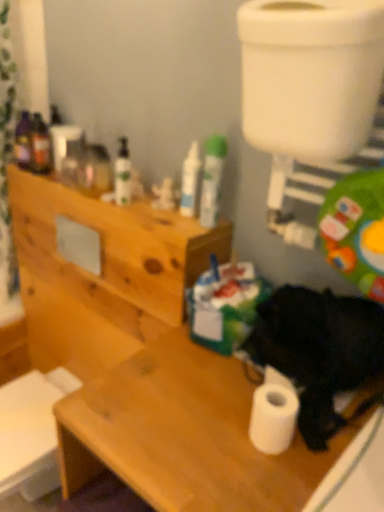
Question: Considering the relative sizes of wooden cabinet at upper left and white matte tube at center, which appears as the 1th toiletry when viewed from the right, in the image provided, is wooden cabinet at upper left thinner than white matte tube at center, which appears as the 1th toiletry when viewed from the right,?

Choices:
 (A) yes
 (B) no

Answer: (B)

Question: Is white matte tube at center, which appears as the 1th toiletry when viewed from the right, inside wooden cabinet at upper left?

Choices:
 (A) no
 (B) yes

Answer: (A)

Question: Does wooden cabinet at upper left lie behind white matte tube at center, the 3th toiletry from the left?

Choices:
 (A) yes
 (B) no

Answer: (A)

Question: Is wooden cabinet at upper left facing towards white matte tube at center, which appears as the 1th toiletry when viewed from the right?

Choices:
 (A) yes
 (B) no

Answer: (B)

Question: From a real-world perspective, is wooden cabinet at upper left located beneath white matte tube at center, the 3th toiletry from the left?

Choices:
 (A) no
 (B) yes

Answer: (B)

Question: Can you confirm if wooden cabinet at upper left is taller than white matte tube at center, which appears as the 1th toiletry when viewed from the right?

Choices:
 (A) yes
 (B) no

Answer: (A)

Question: Is black fur dog at lower right located outside white matte tube at center, the 3th toiletry from the left?

Choices:
 (A) no
 (B) yes

Answer: (B)

Question: Would you say black fur dog at lower right contains white matte tube at center, which appears as the 1th toiletry when viewed from the right?

Choices:
 (A) no
 (B) yes

Answer: (A)

Question: From the image's perspective, is black fur dog at lower right on top of white matte tube at center, which appears as the 1th toiletry when viewed from the right?

Choices:
 (A) no
 (B) yes

Answer: (A)

Question: Is black fur dog at lower right thinner than white matte tube at center, the 3th toiletry from the left?

Choices:
 (A) yes
 (B) no

Answer: (B)

Question: Is there a large distance between black fur dog at lower right and white matte tube at center, which appears as the 1th toiletry when viewed from the right?

Choices:
 (A) yes
 (B) no

Answer: (B)

Question: Are black fur dog at lower right and white matte tube at center, which appears as the 1th toiletry when viewed from the right, making contact?

Choices:
 (A) yes
 (B) no

Answer: (B)

Question: Is wooden cabinet at upper left at the left side of matte green bottle at upper center, which appears as the third toiletry when viewed from the right?

Choices:
 (A) yes
 (B) no

Answer: (A)